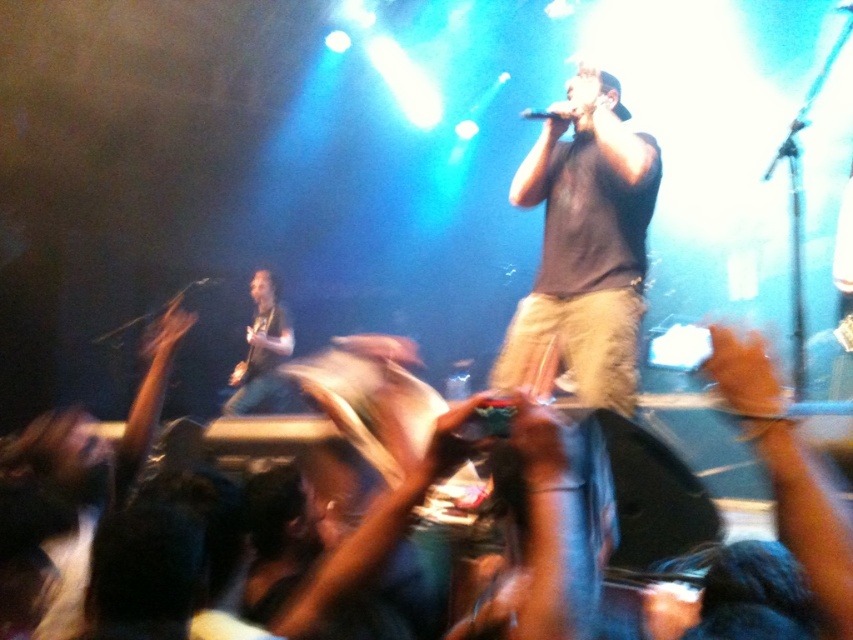
Question: Among these objects, which one is farthest from the camera?

Choices:
 (A) black cotton shirt at center
 (B) black matte microphone at center
 (C) black matte microphone at upper center

Answer: (B)

Question: Is black matte microphone at upper center closer to camera compared to black matte microphone at center?

Choices:
 (A) yes
 (B) no

Answer: (A)

Question: Among these points, which one is farthest from the camera?

Choices:
 (A) (544, 109)
 (B) (561, 284)
 (C) (206, 280)

Answer: (C)

Question: Where is black matte microphone at upper center located in relation to black matte microphone at center in the image?

Choices:
 (A) above
 (B) below

Answer: (A)

Question: Among these points, which one is farthest from the camera?

Choices:
 (A) (556, 220)
 (B) (531, 115)
 (C) (218, 280)

Answer: (C)

Question: Can you confirm if black cotton shirt at center is bigger than black matte microphone at center?

Choices:
 (A) no
 (B) yes

Answer: (B)